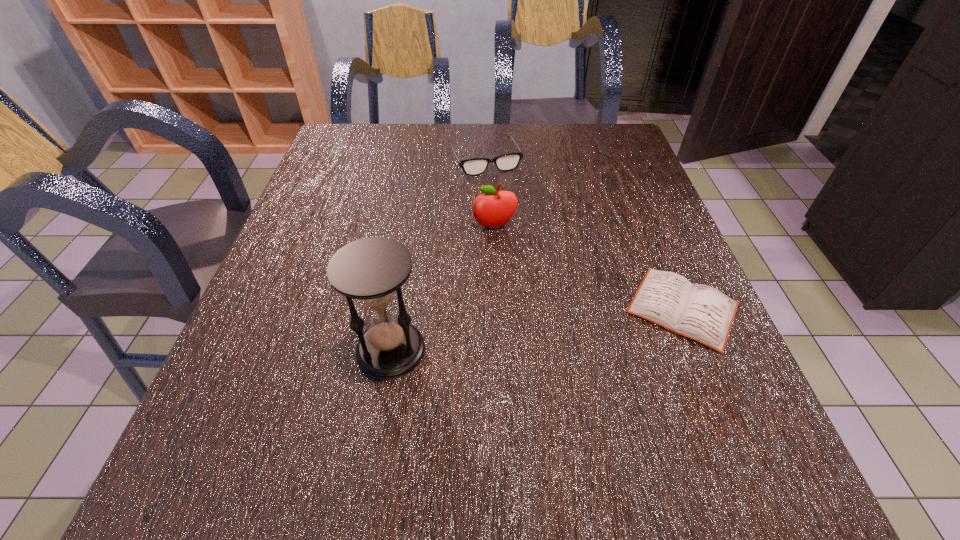
I want to click on vacant space positioned on the front-facing side of the second tallest object, so click(515, 299).

Where is `vacant space situated on the front-facing side of the second tallest object`? The width and height of the screenshot is (960, 540). vacant space situated on the front-facing side of the second tallest object is located at coordinates (535, 377).

Locate an element on the screen. This screenshot has width=960, height=540. blank area located on the front-facing side of the second tallest object is located at coordinates (503, 252).

This screenshot has width=960, height=540. I want to click on free space located 0.140m on the front-facing side of the farthest object, so click(x=510, y=207).

At what (x,y) coordinates should I click in order to perform the action: click on free space located 0.070m on the front-facing side of the farthest object. Please return your answer as a coordinate pair (x, y). The height and width of the screenshot is (540, 960). Looking at the image, I should click on (502, 191).

The height and width of the screenshot is (540, 960). Identify the location of free space located on the front-facing side of the farthest object. (517, 222).

The width and height of the screenshot is (960, 540). Find the location of `object located in the far edge section of the desktop`. object located in the far edge section of the desktop is located at coordinates (476, 166).

Locate an element on the screen. The height and width of the screenshot is (540, 960). object that is at the right edge is located at coordinates (702, 313).

The height and width of the screenshot is (540, 960). Find the location of `vacant region at the far edge of the desktop`. vacant region at the far edge of the desktop is located at coordinates (570, 145).

The image size is (960, 540). Find the location of `vacant space at the near edge of the desktop`. vacant space at the near edge of the desktop is located at coordinates (324, 424).